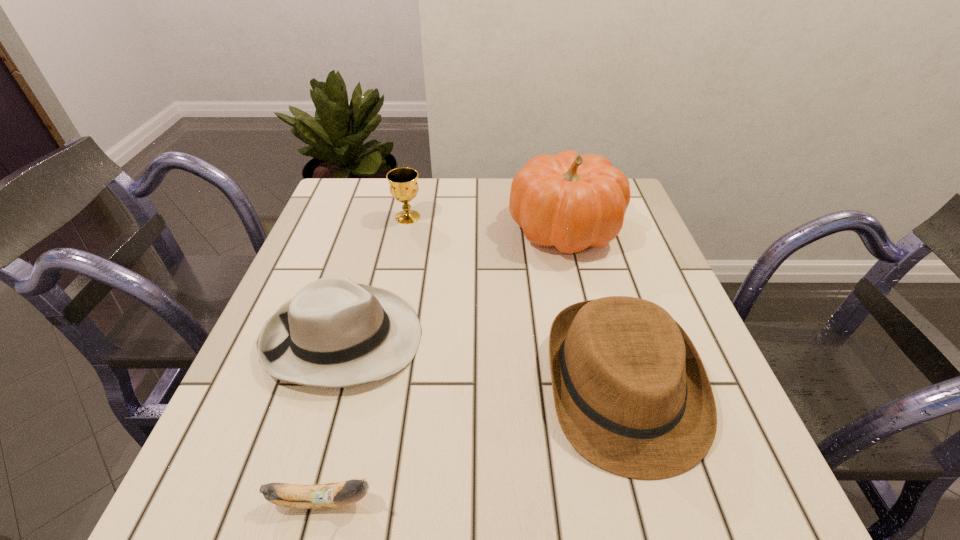
The width and height of the screenshot is (960, 540). Identify the location of pumpkin that is at the far edge. (569, 201).

At what (x,y) coordinates should I click in order to perform the action: click on chalice present at the far edge. Please return your answer as a coordinate pair (x, y). Looking at the image, I should click on (403, 183).

Locate an element on the screen. fedora that is at the near edge is located at coordinates (632, 396).

Image resolution: width=960 pixels, height=540 pixels. Find the location of `banana at the near edge`. banana at the near edge is located at coordinates (329, 495).

Identify the location of fedora located at the left edge. (334, 332).

Image resolution: width=960 pixels, height=540 pixels. Find the location of `banana that is at the left edge`. banana that is at the left edge is located at coordinates (329, 495).

In order to click on pumpkin positioned at the right edge in this screenshot , I will do `click(569, 201)`.

Locate an element on the screen. This screenshot has width=960, height=540. fedora positioned at the right edge is located at coordinates (632, 396).

This screenshot has height=540, width=960. In order to click on object that is at the near left corner in this screenshot , I will do `click(329, 495)`.

At what (x,y) coordinates should I click in order to perform the action: click on object present at the far right corner. Please return your answer as a coordinate pair (x, y). Image resolution: width=960 pixels, height=540 pixels. Looking at the image, I should click on click(569, 201).